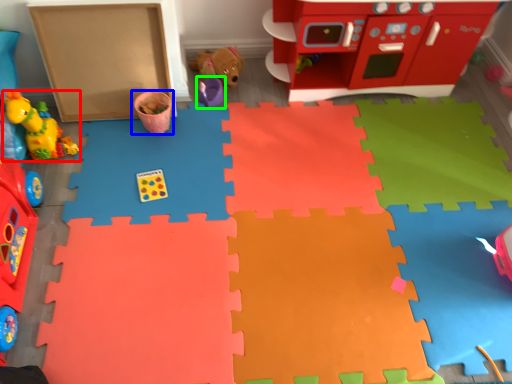
Question: Based on their relative distances, which object is farther from toy (highlighted by a red box)? Choose from toy (highlighted by a blue box) and toy (highlighted by a green box).

Choices:
 (A) toy
 (B) toy

Answer: (B)